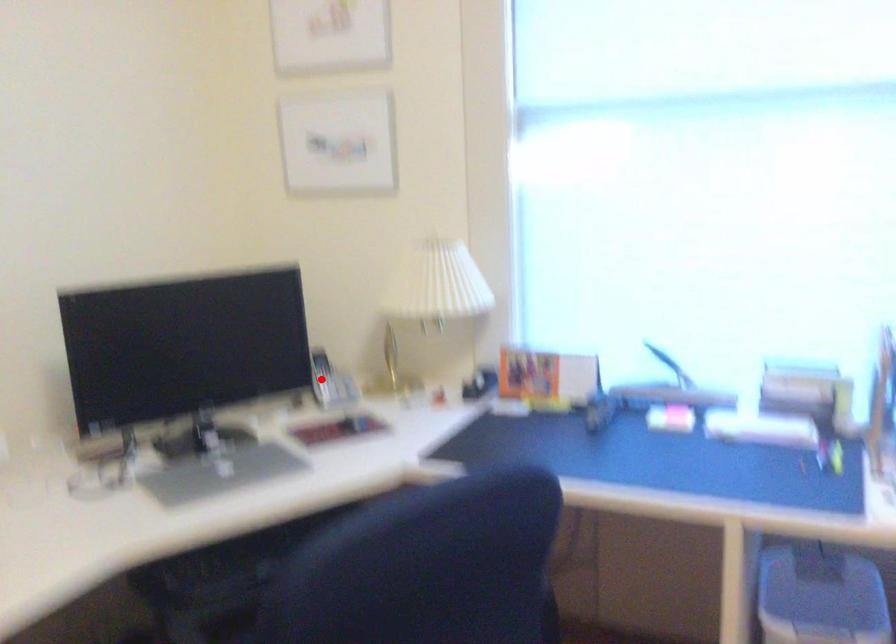
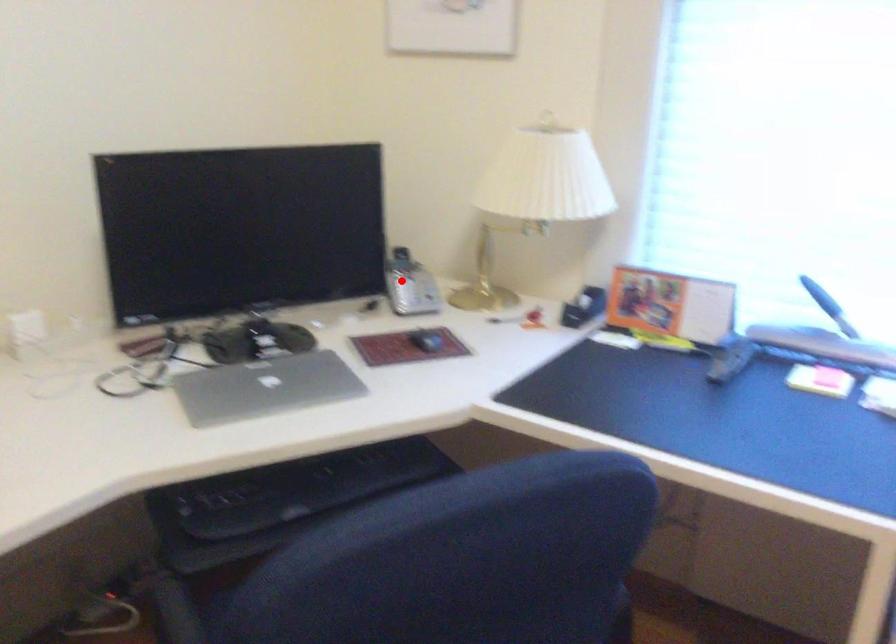
Looking at this image, I am providing you with two images of the same scene from different viewpoints. A red point is marked on the first image and another point is marked on the second image. Are the points marked in image1 and image2 representing the same 3D position?

Yes